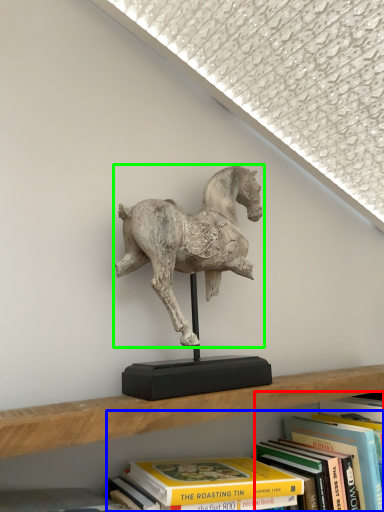
Question: Which is nearer to the book (highlighted by a red box)? book (highlighted by a blue box) or horse (highlighted by a green box).

Choices:
 (A) book
 (B) horse

Answer: (A)